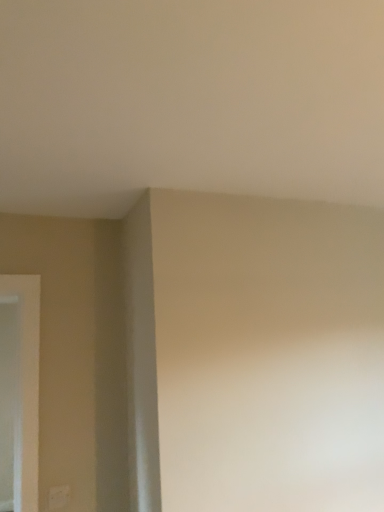
Locate an element on the screen. This screenshot has width=384, height=512. white matte electric outlet at lower left is located at coordinates (58, 497).

Describe the element at coordinates (58, 497) in the screenshot. The width and height of the screenshot is (384, 512). I see `white matte electric outlet at lower left` at that location.

The height and width of the screenshot is (512, 384). Identify the location of white matte electric outlet at lower left. (58, 497).